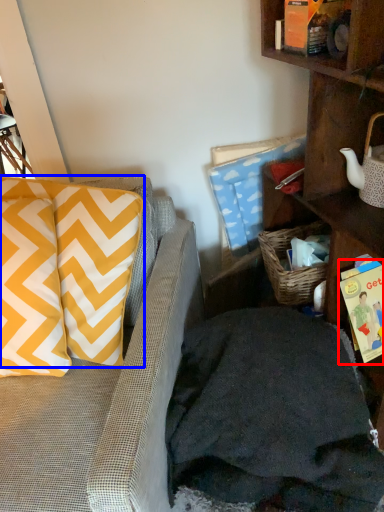
Question: Which point is further to the camera, book (highlighted by a red box) or pillow (highlighted by a blue box)?

Choices:
 (A) book
 (B) pillow

Answer: (A)